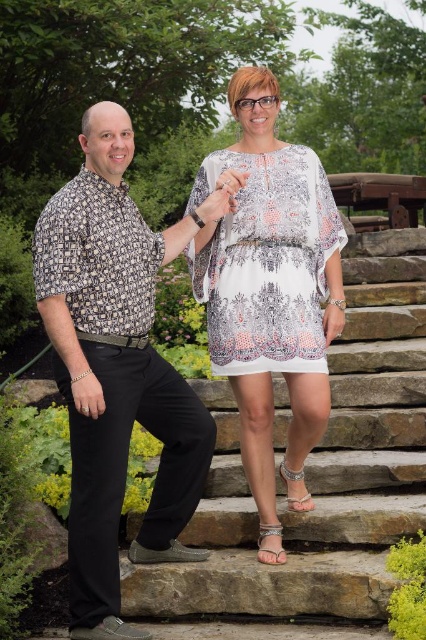
Question: Which of the following is the closest to the observer?

Choices:
 (A) (215, 259)
 (B) (221, 204)
 (C) (279, 561)

Answer: (B)

Question: Is silver metallic sandal at lower center wider than white lace hand at center?

Choices:
 (A) no
 (B) yes

Answer: (A)

Question: Can you confirm if metallic silver sandal at lower center is thinner than white lace hand at center?

Choices:
 (A) yes
 (B) no

Answer: (A)

Question: Which object is closer to the camera taking this photo?

Choices:
 (A) metallic silver sandal at lower center
 (B) white sheer dress at center

Answer: (B)

Question: Among these objects, which one is nearest to the camera?

Choices:
 (A) white sheer dress at center
 (B) silver metallic sandal at lower center

Answer: (A)

Question: Can you confirm if white fabric dress at center is bigger than white printed fabric dress at center?

Choices:
 (A) no
 (B) yes

Answer: (B)